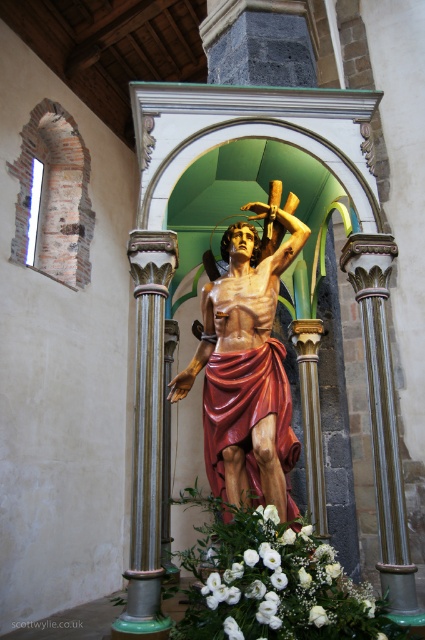
You are standing in front of the statue and want to determine which of the two points, point (266, 460) or point (376, 500), is closer to you. Based on the statue and its niche, which point is nearer?

Point (266, 460) is further to the viewer than point (376, 500), so the closer point to you is point (376, 500).

You are an interior designer planning to place a new decorative item in the church. You have the wooden statue at center and the white floral bouquet at lower center in view. Which object should you consider for placement adjustments if you want to emphasize the smaller one?

The white floral bouquet at lower center is smaller than the wooden statue at center. To emphasize it, you could place it in a more prominent position or add lighting to highlight its size relative to the statue.

You are an art conservator examining the statue of Saint Sebastian in the church. You notice two points on the statue that need restoration. One is at point (x=257, y=406) and the other at point (x=254, y=630). Which point is closer to you as you stand in front of the statue?

Point (x=257, y=406) is further to the viewer than point (x=254, y=630), so the point closer to you is point (x=254, y=630).